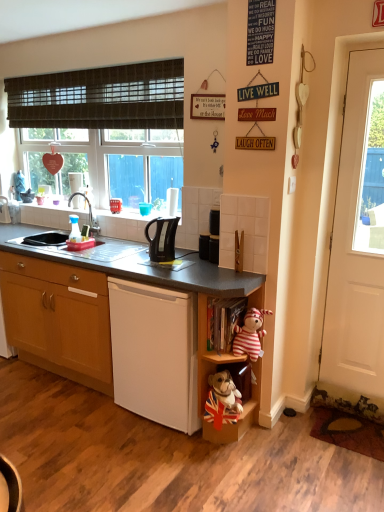
I want to click on vacant area that is in front of wooden cabinet at lower left, so [72, 423].